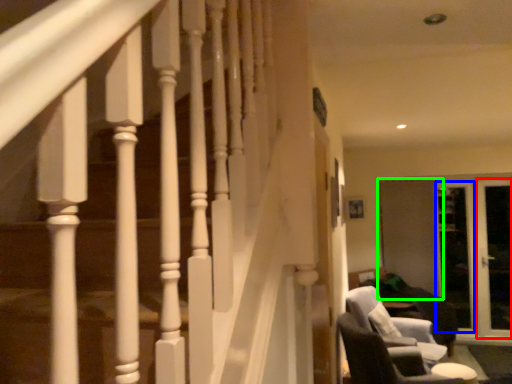
Question: Which is nearer to the screen door (highlighted by a red box)? screen door (highlighted by a blue box) or screen door (highlighted by a green box).

Choices:
 (A) screen door
 (B) screen door

Answer: (A)